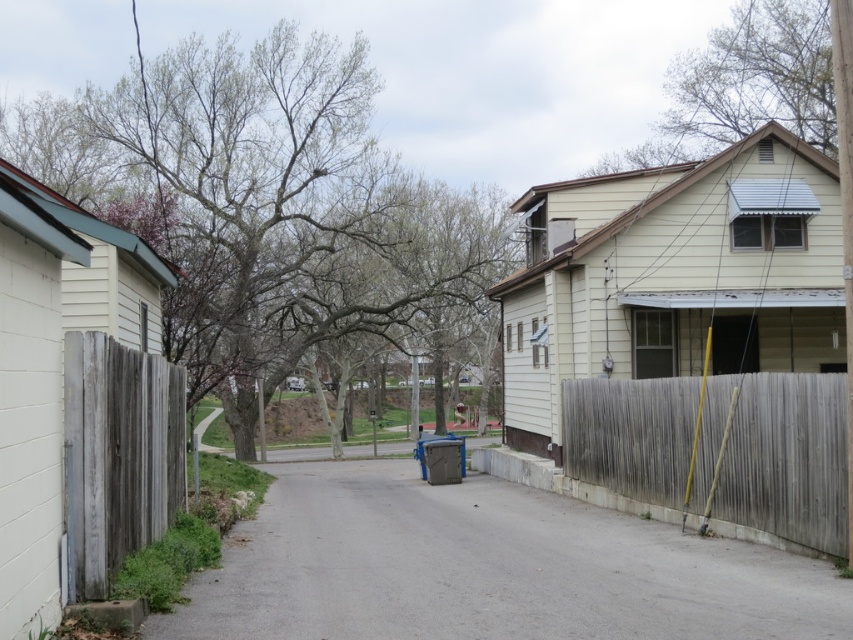
Question: Is weathered wood fence at right above weathered wood fence at left?

Choices:
 (A) yes
 (B) no

Answer: (B)

Question: Estimate the real-world distances between objects in this image. Which object is farther from the weathered wood fence at right?

Choices:
 (A) weathered wood fence at left
 (B) gray concrete driveway at lower center

Answer: (A)

Question: Can you confirm if gray concrete driveway at lower center is bigger than weathered wood fence at right?

Choices:
 (A) yes
 (B) no

Answer: (A)

Question: Based on their relative distances, which object is nearer to the gray concrete driveway at lower center?

Choices:
 (A) weathered wood fence at right
 (B) weathered wood fence at left

Answer: (B)

Question: Which point is farther to the camera?

Choices:
 (A) weathered wood fence at left
 (B) weathered wood fence at right
 (C) gray concrete driveway at lower center

Answer: (B)

Question: Can you confirm if gray concrete driveway at lower center is wider than weathered wood fence at left?

Choices:
 (A) yes
 (B) no

Answer: (A)